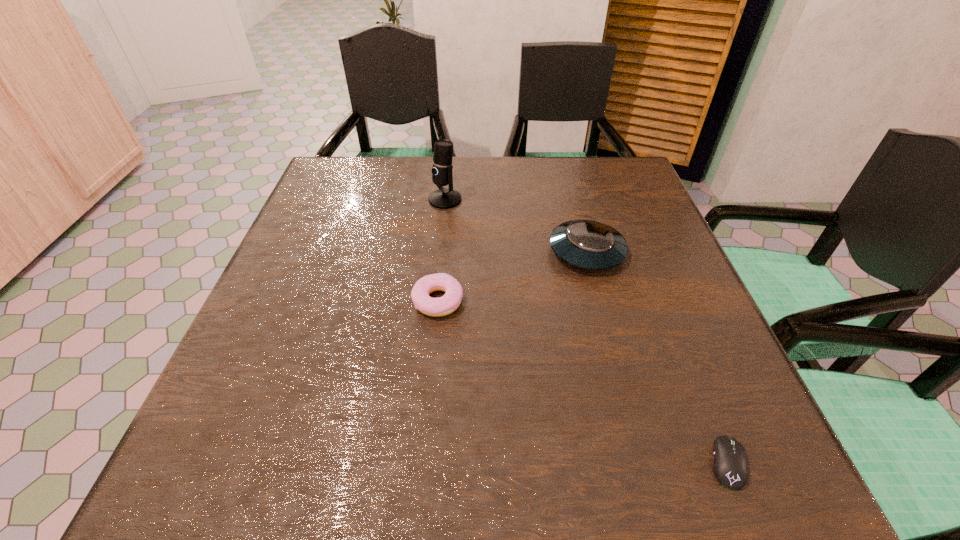
Image resolution: width=960 pixels, height=540 pixels. Find the location of `empty space that is in between the shortest object and the saucer`. empty space that is in between the shortest object and the saucer is located at coordinates (658, 357).

Locate an element on the screen. The width and height of the screenshot is (960, 540). unoccupied position between the shortest object and the microphone is located at coordinates (587, 332).

At what (x,y) coordinates should I click in order to perform the action: click on empty location between the rightmost object and the doughnut. Please return your answer as a coordinate pair (x, y). The height and width of the screenshot is (540, 960). Looking at the image, I should click on (583, 382).

The width and height of the screenshot is (960, 540). Find the location of `vacant space that is in between the microphone and the third object from left to right`. vacant space that is in between the microphone and the third object from left to right is located at coordinates (516, 226).

This screenshot has width=960, height=540. Find the location of `object that is the second closest one to the second nearest object`. object that is the second closest one to the second nearest object is located at coordinates [x=442, y=198].

The height and width of the screenshot is (540, 960). What are the coordinates of `object that stands as the third closest to the third farthest object` in the screenshot? It's located at (730, 467).

Find the location of a particular element. free location that satisfies the following two spatial constraints: 1. on the front side of the saucer; 2. on the left side of the shortest object is located at coordinates [x=643, y=463].